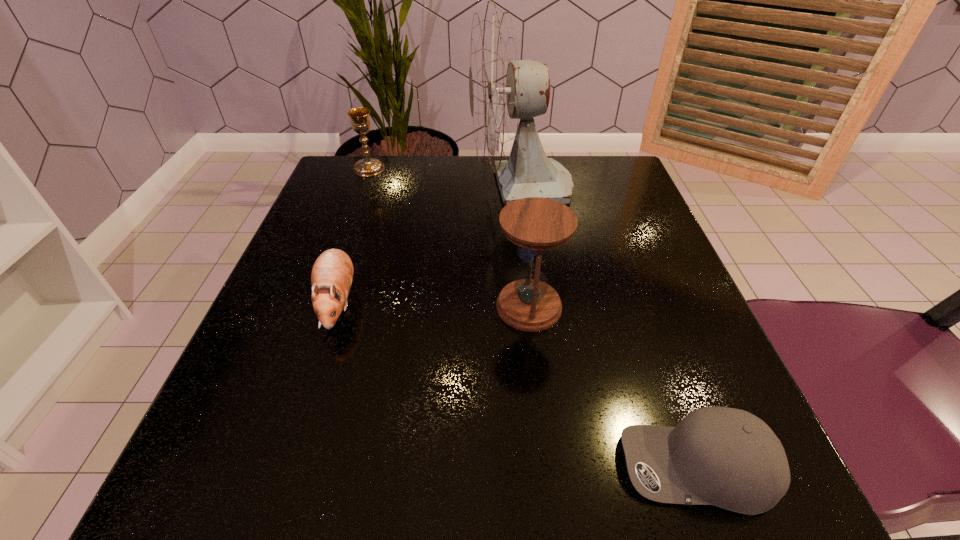
The height and width of the screenshot is (540, 960). I want to click on fan, so click(x=502, y=89).

Locate an element on the screen. hourglass is located at coordinates (537, 226).

What are the coordinates of `the third tallest object` in the screenshot? It's located at (360, 121).

Where is `hamster`? This screenshot has height=540, width=960. hamster is located at coordinates (332, 273).

Locate an element on the screen. This screenshot has height=540, width=960. baseball cap is located at coordinates (729, 458).

Image resolution: width=960 pixels, height=540 pixels. I want to click on vacant region located 0.080m in front of the tallest object to blow air, so click(x=434, y=188).

The image size is (960, 540). In order to click on vacant region located in front of the tallest object to blow air in this screenshot , I will do `click(345, 188)`.

Locate an element on the screen. This screenshot has height=540, width=960. free spot located 0.200m in front of the tallest object to blow air is located at coordinates (380, 188).

Locate an element on the screen. Image resolution: width=960 pixels, height=540 pixels. free region located 0.360m on the back of the hourglass is located at coordinates (515, 177).

What are the coordinates of `blank space located 0.370m on the front of the third tallest object` in the screenshot? It's located at (324, 289).